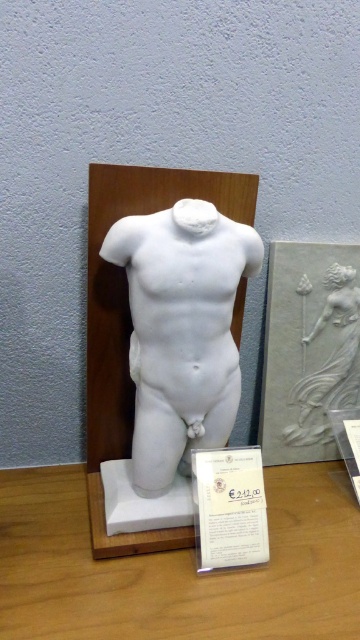
Can you confirm if wooden table at center is thinner than white marble torso at center?

Incorrect, wooden table at center's width is not less than white marble torso at center's.

Where is `wooden table at center`? The image size is (360, 640). wooden table at center is located at coordinates (177, 566).

Is point (213, 262) positioned before point (348, 282)?

Yes, it is.

Where is `white marble torso at center`? Image resolution: width=360 pixels, height=640 pixels. white marble torso at center is located at coordinates (182, 332).

Is point (231, 509) farther from viewer compared to point (303, 426)?

That is False.

Can you confirm if white paper at center is shorter than white marble relief at center?

Yes.

Who is more distant from viewer, (262, 545) or (302, 426)?

Positioned behind is point (302, 426).

I want to click on white paper at center, so click(x=228, y=508).